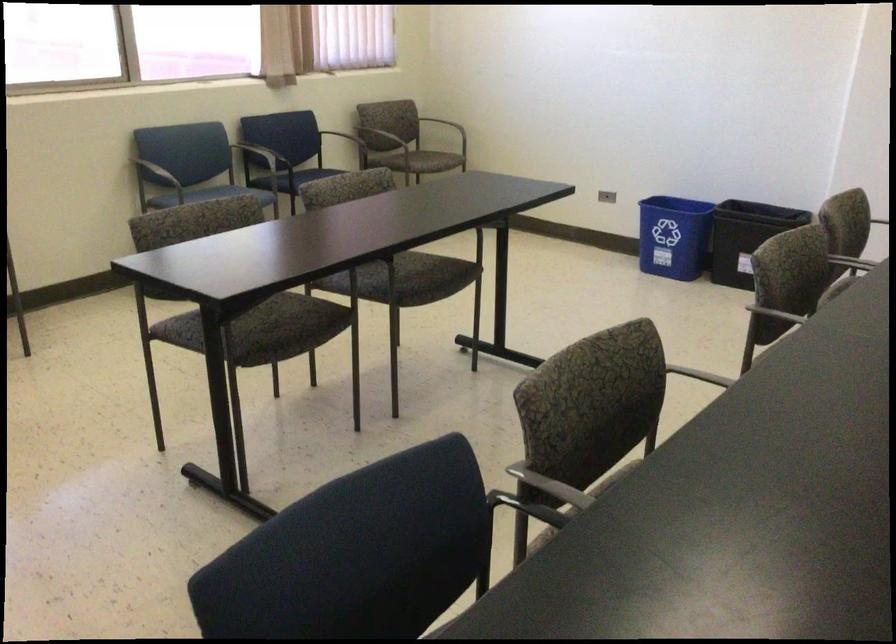
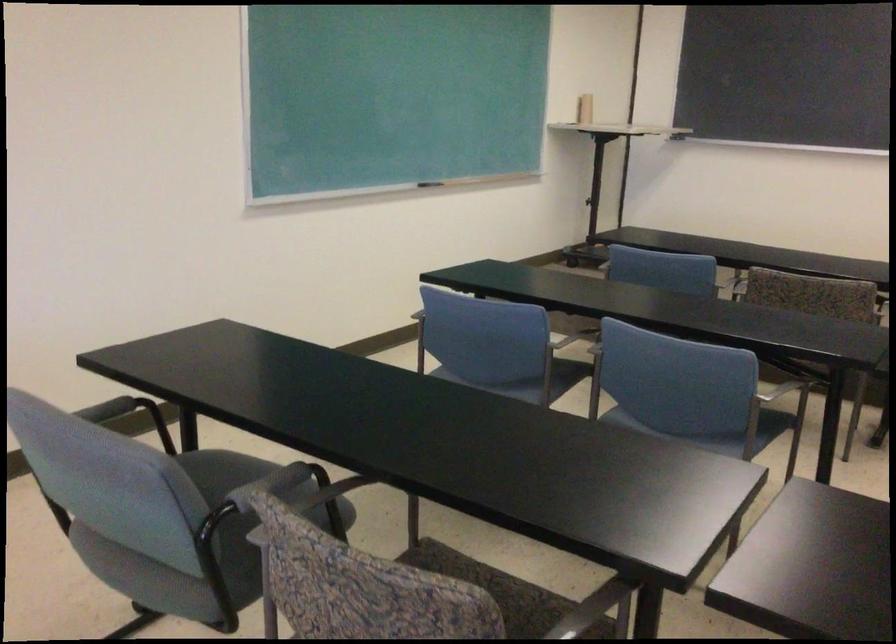
Question: Which direction would the cameraman need to move to produce the second image? Reply with the corresponding letter.

Choices:
 (A) Left
 (B) Right
 (C) Forward
 (D) Backward

Answer: (D)